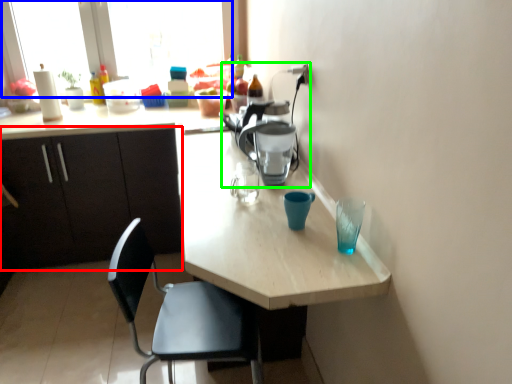
Question: Which is farther away from cabinetry (highlighted by a red box)? window screen (highlighted by a blue box) or coffeepot (highlighted by a green box)?

Choices:
 (A) window screen
 (B) coffeepot

Answer: (B)